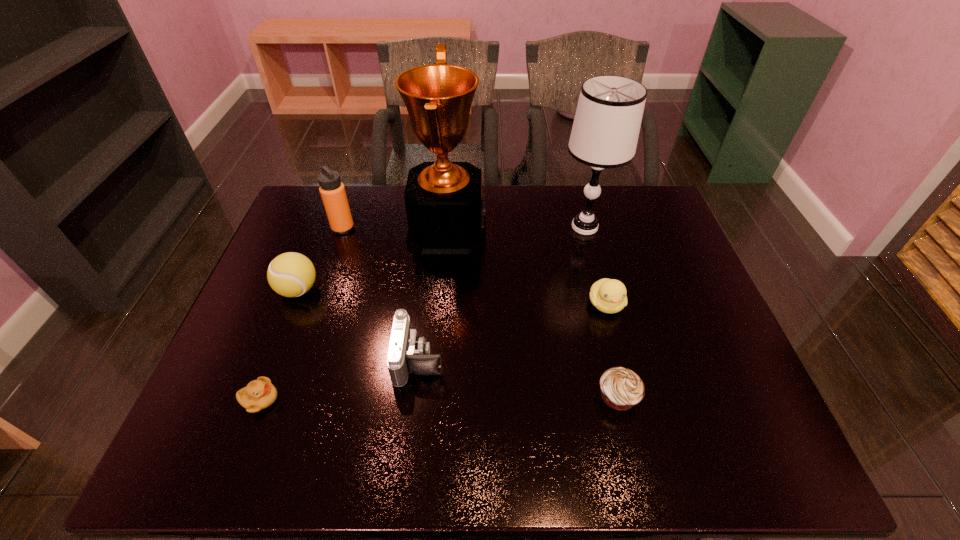
I want to click on thermos bottle present at the far edge, so click(333, 194).

The height and width of the screenshot is (540, 960). I want to click on thermos bottle at the left edge, so click(x=333, y=194).

Locate an element on the screen. The height and width of the screenshot is (540, 960). tennis ball positioned at the left edge is located at coordinates (291, 274).

The width and height of the screenshot is (960, 540). Find the location of `duckling present at the left edge`. duckling present at the left edge is located at coordinates (259, 394).

I want to click on object that is at the far left corner, so click(x=333, y=194).

Locate an element on the screen. The width and height of the screenshot is (960, 540). free point at the far edge is located at coordinates (598, 198).

What are the coordinates of `free region at the near edge` in the screenshot? It's located at (524, 465).

Locate an element on the screen. This screenshot has height=540, width=960. vacant space at the left edge of the desktop is located at coordinates (267, 363).

Locate an element on the screen. The height and width of the screenshot is (540, 960). blank area at the right edge is located at coordinates (692, 371).

In the image, there is a desktop. Identify the location of vacant space at the near left corner. (190, 456).